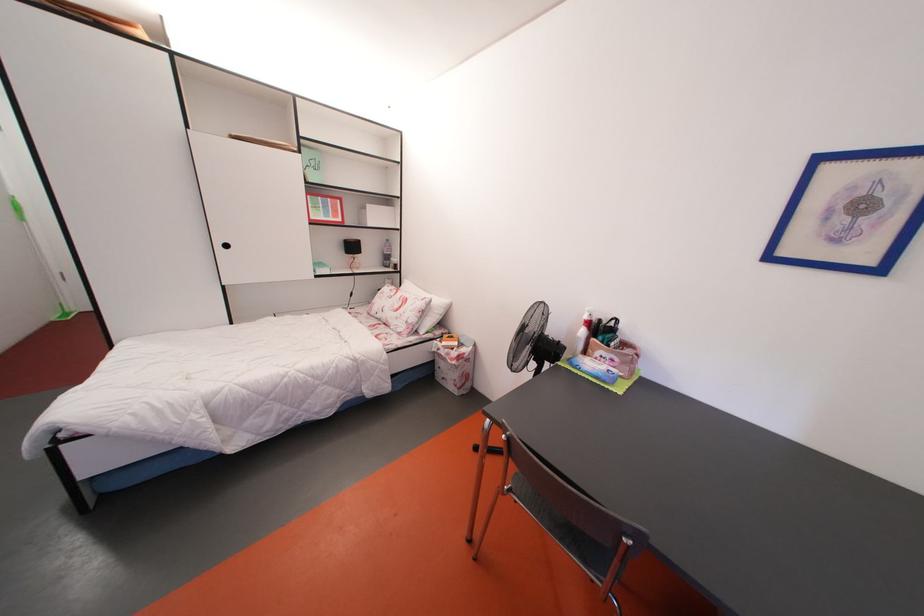
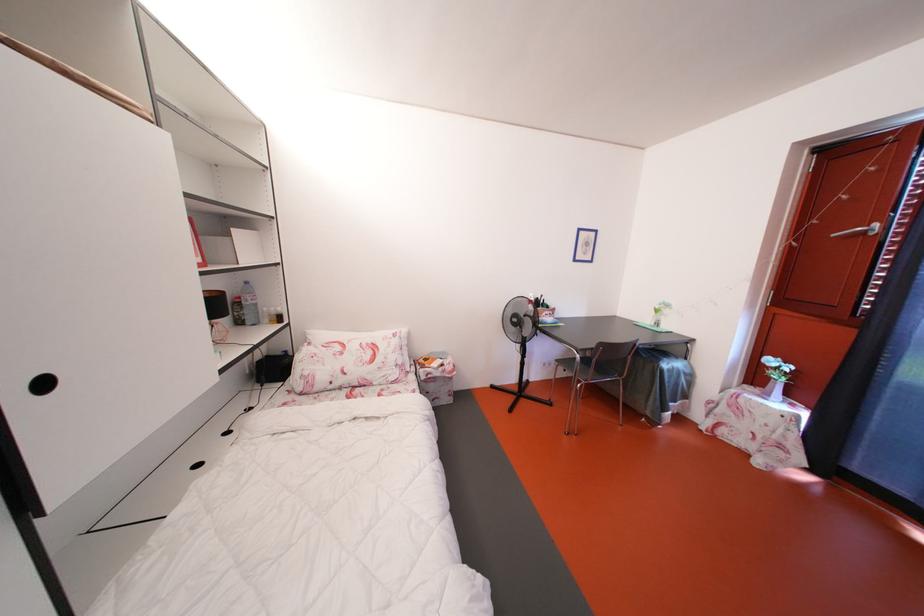
Where in the second image is the point corresponding to pixel 234 252 from the first image?

(52, 390)